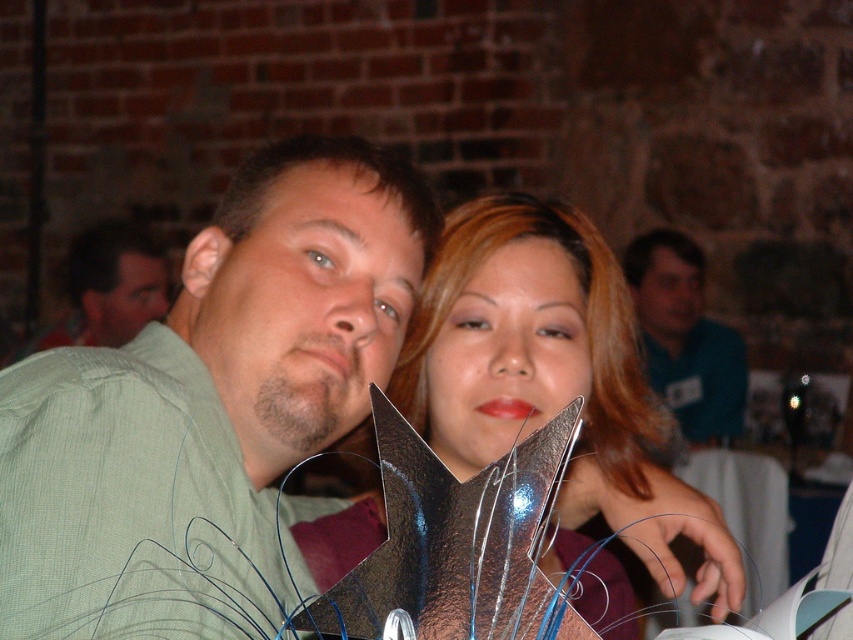
Question: Which point is closer to the camera taking this photo?

Choices:
 (A) (663, 237)
 (B) (576, 556)
 (C) (680, 598)
 (D) (247, 196)

Answer: (D)

Question: Which point is closer to the camera?

Choices:
 (A) blue shirt at upper right
 (B) white glossy table at lower right
 (C) green matte shirt at left
 (D) matte green shirt at center

Answer: (C)

Question: Which object is the farthest from the green matte shirt at left?

Choices:
 (A) matte green shirt at center
 (B) shiny metallic trophy at center
 (C) blue shirt at upper right

Answer: (A)

Question: Is green matte shirt at left to the left of white glossy table at lower right from the viewer's perspective?

Choices:
 (A) no
 (B) yes

Answer: (B)

Question: Does green matte shirt at left come behind shiny metallic trophy at center?

Choices:
 (A) no
 (B) yes

Answer: (B)

Question: Does blue shirt at upper right lie in front of white glossy table at lower right?

Choices:
 (A) no
 (B) yes

Answer: (A)